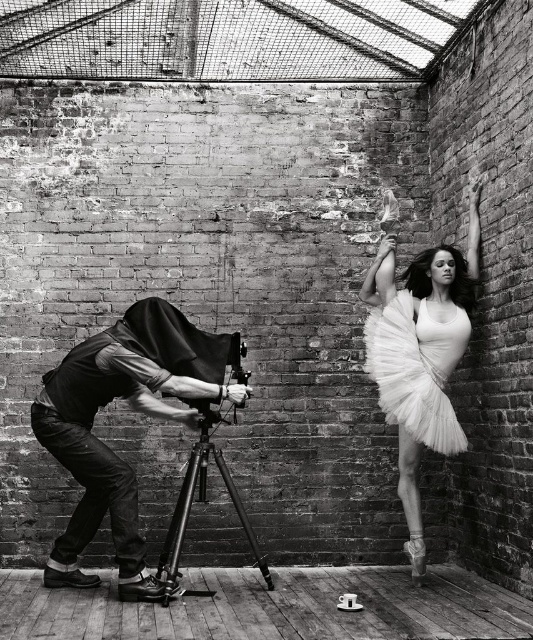
You are a photographer in the scene and want to capture the white fluffy tutu at upper right and the white tulle dress at upper right. Which one is more to the left in the photo?

The white fluffy tutu at upper right is more to the left in the photo because it is positioned on the left side of the white tulle dress at upper right.

You are a photographer in the scene and want to ensure both the denim vest at left and the white fluffy tutu at upper right are in focus. Which clothing item is closer to the camera?

The denim vest at left is shorter than the white fluffy tutu at upper right, so the denim vest at left is closer to the camera.